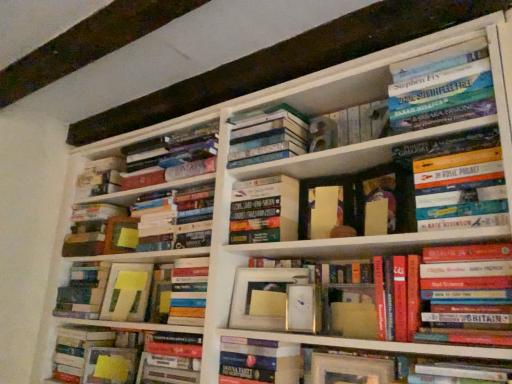
The width and height of the screenshot is (512, 384). What do you see at coordinates (457, 180) in the screenshot? I see `hardcover book at upper right, acting as the 1th book starting from the right` at bounding box center [457, 180].

Locate an element on the screen. hardcover book at upper center, which ranks as the fifth book in right-to-left order is located at coordinates (268, 136).

Locate an element on the screen. This screenshot has height=384, width=512. hardcover book at center, placed as the fourth book when sorted from right to left is located at coordinates (464, 372).

What is the approximate height of matte yellow paper at center, the 2th paperback book positioned from the left?

6.66 inches.

Describe the element at coordinates (265, 211) in the screenshot. The width and height of the screenshot is (512, 384). I see `hardcover book at center, which appears as the 7th book when viewed from the left` at that location.

The height and width of the screenshot is (384, 512). In order to click on hardcover book at upper right, acting as the 1th book starting from the right in this screenshot , I will do `click(457, 180)`.

Is hardcover book at center, which appears as the 7th book when viewed from the left, aimed at matte white frame at center, which appears as the 3th paperback book when viewed from the left?

No.

I want to click on the 2nd book behind the matte white frame at center, which appears as the 3th paperback book when viewed from the left, counting from the anchor's position, so click(265, 211).

Who is smaller, hardcover book at center, which appears as the 7th book when viewed from the left, or matte white frame at center, which appears as the 1th paperback book when viewed from the right?

Smaller between the two is matte white frame at center, which appears as the 1th paperback book when viewed from the right.

From the image's perspective, is hardcover book at center, which appears as the 7th book when viewed from the left, above or below matte white frame at center, the 1th paperback book from the front?

Clearly, from the image's perspective, hardcover book at center, which appears as the 7th book when viewed from the left, is above matte white frame at center, the 1th paperback book from the front.

Is hardcover book at upper right, the twelfth book positioned from the left, oriented away from hardcover book at lower left, positioned as the fourth book in left-to-right order?

That's not correct — hardcover book at upper right, the twelfth book positioned from the left, is not looking away from hardcover book at lower left, positioned as the fourth book in left-to-right order.

Which of these two, hardcover book at upper right, acting as the 1th book starting from the right, or hardcover book at lower left, which is the ninth book from right to left, is bigger?

With larger size is hardcover book at upper right, acting as the 1th book starting from the right.

Between hardcover book at upper right, the twelfth book positioned from the left, and hardcover book at lower left, positioned as the fourth book in left-to-right order, which one has smaller width?

Thinner between the two is hardcover book at lower left, positioned as the fourth book in left-to-right order.

Between hardcover book at upper right, acting as the 1th book starting from the right, and hardcover book at lower left, which is the ninth book from right to left, which one has more height?

hardcover book at upper right, acting as the 1th book starting from the right.

Which is correct: hardcover books at center, which is counted as the 3th book, starting from the right, is inside hardcover book at center, which is the 11th book from right to left, or outside of it?

The correct answer is: outside.

Considering the relative sizes of hardcover books at center, arranged as the 10th book when viewed from the left, and hardcover book at center, which is the 11th book from right to left, in the image provided, is hardcover books at center, arranged as the 10th book when viewed from the left, wider than hardcover book at center, which is the 11th book from right to left,?

Incorrect, the width of hardcover books at center, arranged as the 10th book when viewed from the left, does not surpass that of hardcover book at center, which is the 11th book from right to left.

In the scene shown: Considering the relative positions of hardcover books at center, which is counted as the 3th book, starting from the right, and hardcover book at center, which is the 11th book from right to left, in the image provided, is hardcover books at center, which is counted as the 3th book, starting from the right, behind hardcover book at center, which is the 11th book from right to left,?

No.

Are hardcover books at center, which is counted as the 3th book, starting from the right, and hardcover book at center, the second book from the left, far apart?

They are positioned close to each other.

Based on the photo, which of these two, hardcover book at center, the sixth book when ordered from right to left, or hardcover book at center, acting as the seventh book starting from the right, is wider?

With larger width is hardcover book at center, acting as the seventh book starting from the right.

From a real-world perspective, count 7th books upward from the hardcover book at center, placed as the 6th book when sorted from left to right, and point to it. Please provide its 2D coordinates.

[(265, 211)]

Does hardcover book at center, the sixth book when ordered from right to left, have a greater height compared to hardcover book at center, acting as the seventh book starting from the right?

Correct, hardcover book at center, the sixth book when ordered from right to left, is much taller as hardcover book at center, acting as the seventh book starting from the right.

Between hardcover book at center, which appears as the 7th book when viewed from the left, and hardcover book at center, acting as the seventh book starting from the right, which one is positioned in front?

hardcover book at center, acting as the seventh book starting from the right.

From the picture: Considering the sizes of hardcover book at upper right, the second book in the right-to-left sequence, and hardcover book at center, placed as the ninth book when sorted from left to right, in the image, is hardcover book at upper right, the second book in the right-to-left sequence, bigger or smaller than hardcover book at center, placed as the ninth book when sorted from left to right,?

Considering their sizes, hardcover book at upper right, the second book in the right-to-left sequence, takes up more space than hardcover book at center, placed as the ninth book when sorted from left to right.

Is point (449, 104) farther from camera compared to point (447, 375)?

Yes, point (449, 104) is farther from viewer.

Is hardcover book at upper right, the second book in the right-to-left sequence, positioned beyond the bounds of hardcover book at center, placed as the fourth book when sorted from right to left?

Yes.

The height and width of the screenshot is (384, 512). What are the coordinates of `book that is the 2nd object to the right of the hardcover book at center, placed as the fourth book when sorted from right to left, starting at the anchor` in the screenshot? It's located at (444, 90).

Is hardcover book at upper right, the twelfth book positioned from the left, facing away from hardcover books at center, which is counted as the 3th book, starting from the right?

No, hardcover book at upper right, the twelfth book positioned from the left, is not facing away from hardcover books at center, which is counted as the 3th book, starting from the right.

Considering the sizes of objects hardcover book at upper right, the twelfth book positioned from the left, and hardcover books at center, arranged as the 10th book when viewed from the left, in the image provided, who is bigger, hardcover book at upper right, the twelfth book positioned from the left, or hardcover books at center, arranged as the 10th book when viewed from the left,?

With larger size is hardcover books at center, arranged as the 10th book when viewed from the left.

From the image's perspective, which is above, hardcover book at upper right, acting as the 1th book starting from the right, or hardcover books at center, arranged as the 10th book when viewed from the left?

hardcover book at upper right, acting as the 1th book starting from the right.

Which is more to the right, hardcover book at upper right, acting as the 1th book starting from the right, or hardcover books at center, arranged as the 10th book when viewed from the left?

hardcover book at upper right, acting as the 1th book starting from the right.

Is point (210, 145) positioned behind point (127, 226)?

No, (210, 145) is closer to viewer.

In the scene shown: Considering the relative positions of hardcover book at center, which is the 11th book from right to left, and matte yellow paper at center, the 1th paperback book in the back-to-front sequence, in the image provided, is hardcover book at center, which is the 11th book from right to left, to the left of matte yellow paper at center, the 1th paperback book in the back-to-front sequence, from the viewer's perspective?

Incorrect, hardcover book at center, which is the 11th book from right to left, is not on the left side of matte yellow paper at center, the 1th paperback book in the back-to-front sequence.

Which of these two, hardcover book at center, the second book from the left, or matte yellow paper at center, the second paperback book in the right-to-left sequence, is smaller?

Smaller between the two is matte yellow paper at center, the second paperback book in the right-to-left sequence.

The width and height of the screenshot is (512, 384). What are the coordinates of `the 5th book directly above the matte white frame at center, which appears as the 1th paperback book when viewed from the right (from a real-world perspective)` in the screenshot? It's located at (265, 211).

This screenshot has width=512, height=384. What are the coordinates of `book that is the 3rd one when counting forward from the hardcover book at lower left, positioned as the fourth book in left-to-right order` in the screenshot? It's located at (457, 180).

From the image, which object appears to be nearer to hardcover book at center, the second book from the left, hardcover books at center, arranged as the 10th book when viewed from the left, or hardcover book at upper center, which ranks as the fifth book in right-to-left order?

hardcover book at upper center, which ranks as the fifth book in right-to-left order, is positioned closer to the anchor hardcover book at center, the second book from the left.

From the image, which object appears to be farther from hardcover books at center, arranged as the 10th book when viewed from the left, hardcover book at upper center, which ranks as the fifth book in right-to-left order, or matte yellow paper at center, which is the 3th paperback book from front to back?

matte yellow paper at center, which is the 3th paperback book from front to back, lies further to hardcover books at center, arranged as the 10th book when viewed from the left, than the other object.

Considering their positions, is hardcover book at center, the sixth book when ordered from right to left, positioned further to hardcover book at upper right, the twelfth book positioned from the left, than yellow matte paper at center, the first paperback book when ordered from left to right?

Based on the image, yellow matte paper at center, the first paperback book when ordered from left to right, appears to be further to hardcover book at upper right, the twelfth book positioned from the left.

Looking at the image, which one is located closer to hardcover book at center, which is the 11th book from right to left, hardcover book at center, placed as the fourth book when sorted from right to left, or matte yellow paper at center, which is the 3th paperback book from front to back?

The object closer to hardcover book at center, which is the 11th book from right to left, is matte yellow paper at center, which is the 3th paperback book from front to back.

Which object lies nearer to the anchor point hardcover book at center, which appears as the 7th book when viewed from the left, hardcover book at center, acting as the tenth book starting from the right, or hardcover books at center, arranged as the 10th book when viewed from the left?

hardcover book at center, acting as the tenth book starting from the right, is positioned closer to the anchor hardcover book at center, which appears as the 7th book when viewed from the left.

Which object lies further to the anchor point matte yellow paper at center, the 1th paperback book in the back-to-front sequence, hardcover book at center, the 5th book when ordered from left to right, or hardcover book at center, placed as the 6th book when sorted from left to right?

Based on the image, hardcover book at center, placed as the 6th book when sorted from left to right, appears to be further to matte yellow paper at center, the 1th paperback book in the back-to-front sequence.

Estimate the real-world distances between objects in this image. Which object is further from hardcover book at center, the sixth book when ordered from right to left, matte yellow paper at center, the 2th paperback book positioned from the left, or yellow matte paper at center, which appears as the third paperback book when viewed from the right?

matte yellow paper at center, the 2th paperback book positioned from the left.

When comparing their distances from yellow matte paper at center, placed as the 2th paperback book when sorted from back to front, does hardcover books at center, which is counted as the 3th book, starting from the right, or hardcover book at center, acting as the seventh book starting from the right, seem closer?

Among the two, hardcover book at center, acting as the seventh book starting from the right, is located nearer to yellow matte paper at center, placed as the 2th paperback book when sorted from back to front.

The width and height of the screenshot is (512, 384). I want to click on paperback book between hardcover book at lower left, positioned as the fourth book in left-to-right order, and matte yellow paper at center, which is the 3th paperback book from front to back, from front to back, so click(x=127, y=292).

Locate an element on the screen. Image resolution: width=512 pixels, height=384 pixels. paperback book between yellow matte paper at center, the first paperback book when ordered from left to right, and hardcover book at upper center, the eighth book positioned from the left is located at coordinates (120, 235).

I want to click on paperback book between matte yellow paper at center, the 2th paperback book positioned from the left, and hardcover book at upper right, acting as the 1th book starting from the right, so click(x=263, y=297).

Find the location of a particular element. This screenshot has width=512, height=384. paperback book between hardcover books at center, which is counted as the 3th book, starting from the right, and hardcover book at center, which appears as the 7th book when viewed from the left, from front to back is located at coordinates (263, 297).